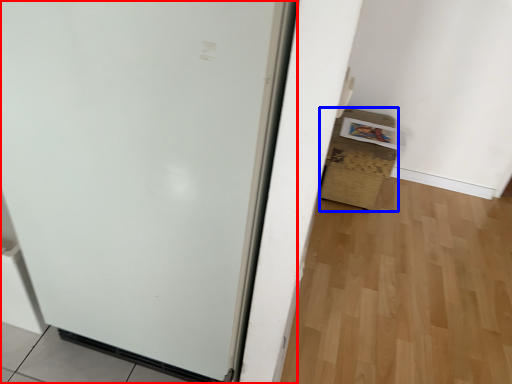
Question: Which object is closer to the camera taking this photo, door (highlighted by a red box) or cardboard box (highlighted by a blue box)?

Choices:
 (A) door
 (B) cardboard box

Answer: (A)